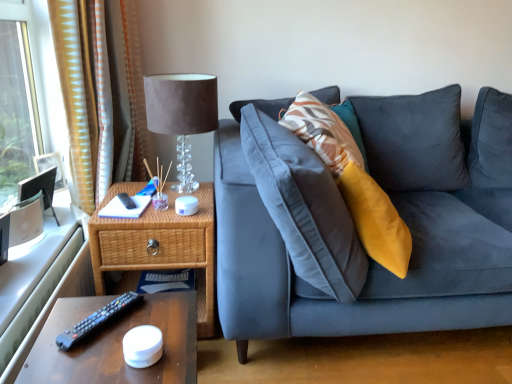
Question: Is yellow striped fabric at left located within suede-like fabric lampshade at upper left?

Choices:
 (A) no
 (B) yes

Answer: (A)

Question: Is suede-like fabric lampshade at upper left wider than yellow striped fabric at left?

Choices:
 (A) no
 (B) yes

Answer: (B)

Question: Does suede-like fabric lampshade at upper left lie behind yellow striped fabric at left?

Choices:
 (A) no
 (B) yes

Answer: (A)

Question: Is suede-like fabric lampshade at upper left completely or partially outside of yellow striped fabric at left?

Choices:
 (A) yes
 (B) no

Answer: (A)

Question: From a real-world perspective, is suede-like fabric lampshade at upper left on yellow striped fabric at left?

Choices:
 (A) yes
 (B) no

Answer: (B)

Question: From the image's perspective, relative to suede-like fabric lampshade at upper left, is black plastic remote at lower left above or below?

Choices:
 (A) below
 (B) above

Answer: (A)

Question: Is black plastic remote at lower left wider or thinner than suede-like fabric lampshade at upper left?

Choices:
 (A) wide
 (B) thin

Answer: (B)

Question: Visually, is black plastic remote at lower left positioned to the left or to the right of suede-like fabric lampshade at upper left?

Choices:
 (A) left
 (B) right

Answer: (A)

Question: Is black plastic remote at lower left situated inside suede-like fabric lampshade at upper left or outside?

Choices:
 (A) outside
 (B) inside

Answer: (A)

Question: Considering their positions, is woven wood nightstand at left located in front of or behind brown wooden table at lower left?

Choices:
 (A) front
 (B) behind

Answer: (B)

Question: Considering the positions of woven wood nightstand at left and brown wooden table at lower left in the image, is woven wood nightstand at left bigger or smaller than brown wooden table at lower left?

Choices:
 (A) big
 (B) small

Answer: (A)

Question: Is woven wood nightstand at left to the left or to the right of brown wooden table at lower left in the image?

Choices:
 (A) right
 (B) left

Answer: (B)

Question: Is point (208, 196) closer or farther from the camera than point (112, 364)?

Choices:
 (A) closer
 (B) farther

Answer: (B)

Question: Relative to woven wood nightstand at left, is black plastic remote at lower left in front or behind?

Choices:
 (A) behind
 (B) front

Answer: (B)

Question: Considering the positions of black plastic remote at lower left and woven wood nightstand at left in the image, is black plastic remote at lower left taller or shorter than woven wood nightstand at left?

Choices:
 (A) short
 (B) tall

Answer: (A)